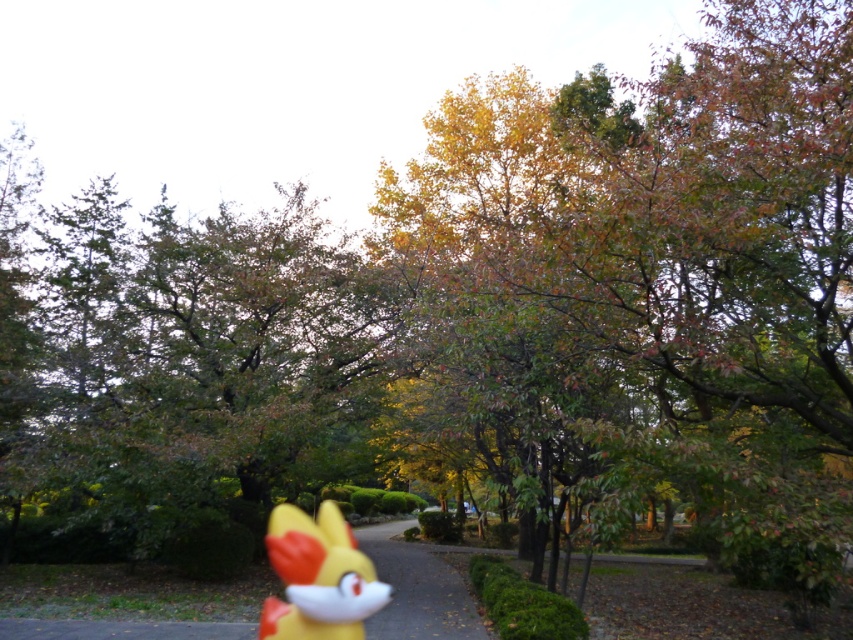
Question: Which point is farther to the camera?

Choices:
 (A) yellow matte toy at center
 (B) yellow plastic toy at center

Answer: (A)

Question: Does yellow plastic toy at center appear on the right side of yellow matte toy at center?

Choices:
 (A) no
 (B) yes

Answer: (A)

Question: Which object is farther from the camera taking this photo?

Choices:
 (A) yellow matte toy at center
 (B) yellow plastic toy at center

Answer: (A)

Question: Does yellow plastic toy at center come in front of yellow matte toy at center?

Choices:
 (A) yes
 (B) no

Answer: (A)

Question: Which object is closer to the camera taking this photo?

Choices:
 (A) yellow matte toy at center
 (B) yellow plastic toy at center

Answer: (B)

Question: Does yellow plastic toy at center come in front of yellow matte toy at center?

Choices:
 (A) yes
 (B) no

Answer: (A)